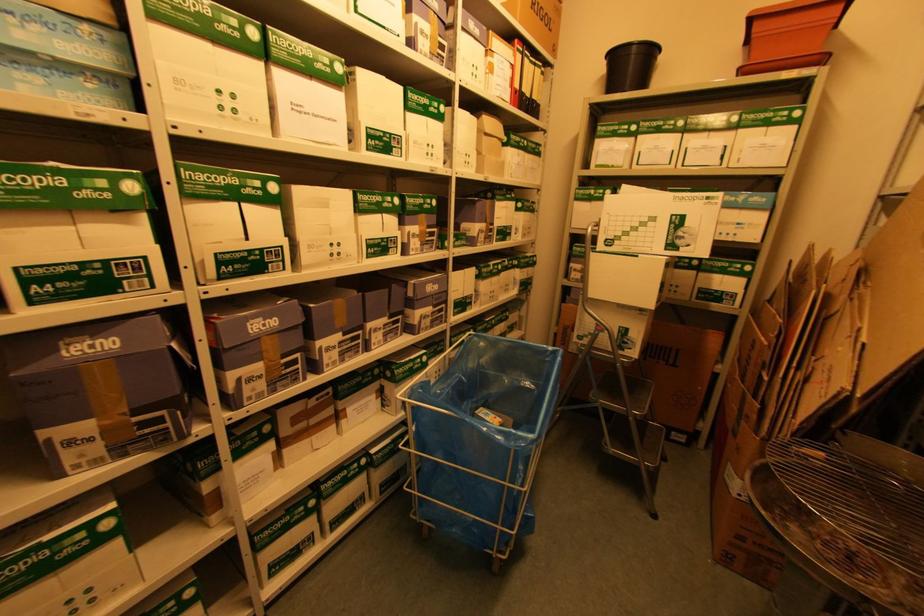
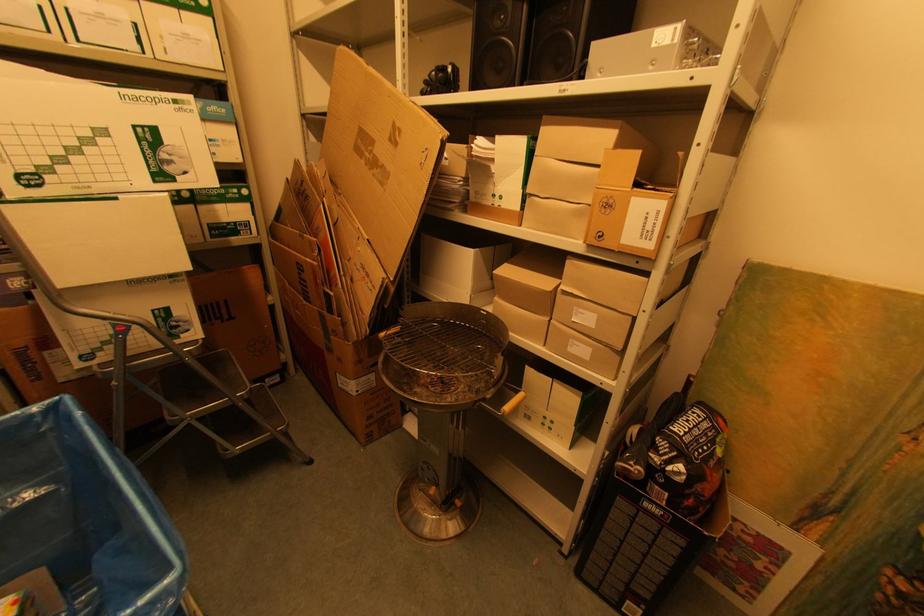
First-person continuous shooting, in which direction is the camera rotating?

The rotation direction of the camera is right-down.